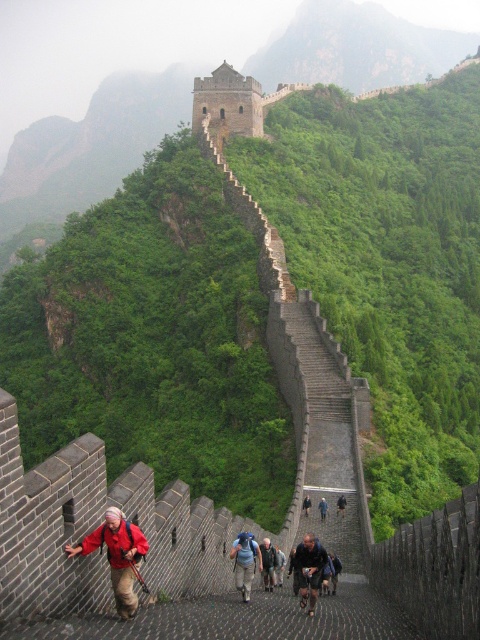
Question: Estimate the real-world distances between objects in this image. Which object is farther from the dark blue fabric backpack at center?

Choices:
 (A) red fabric backpack at lower left
 (B) dark blue backpack at center
 (C) dark gray fabric backpack at center
 (D) denim pants at center

Answer: (C)

Question: Is dark blue fabric backpack at center thinner than blue denim jacket at center?

Choices:
 (A) no
 (B) yes

Answer: (A)

Question: Which point is closer to the camera taking this photo?

Choices:
 (A) (322, 518)
 (B) (120, 564)
 (C) (247, 588)

Answer: (B)

Question: Which of the following is the closest to the observer?

Choices:
 (A) (324, 500)
 (B) (343, 499)

Answer: (A)

Question: Is dark blue fabric backpack at center thinner than dark blue backpack at center?

Choices:
 (A) no
 (B) yes

Answer: (A)

Question: Is dark blue fabric backpack at center smaller than denim pants at center?

Choices:
 (A) no
 (B) yes

Answer: (A)